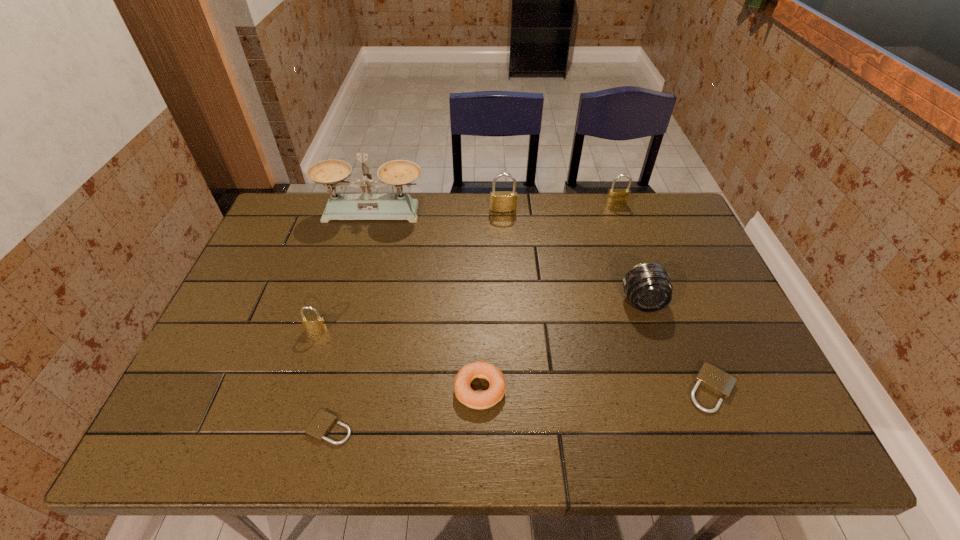
Image resolution: width=960 pixels, height=540 pixels. I want to click on free spot between the second farthest padlock and the tan bagel, so click(492, 300).

This screenshot has height=540, width=960. What are the coordinates of `vacant area between the biggest brass padlock and the third shortest object` in the screenshot? It's located at (492, 300).

Choose which object is the nearest neighbor to the bagel. Please provide its 2D coordinates. Your answer should be formatted as a tuple, i.e. [(x, y)], where the tuple contains the x and y coordinates of a point satisfying the conditions above.

[(322, 423)]

Select which object appears as the fourth closest to the fifth nearest object. Please provide its 2D coordinates. Your answer should be formatted as a tuple, i.e. [(x, y)], where the tuple contains the x and y coordinates of a point satisfying the conditions above.

[(501, 202)]

Locate an element on the screen. padlock that is the closest to the leftmost padlock is located at coordinates (322, 423).

Find the location of `padlock that is the closest to the second farthest padlock`. padlock that is the closest to the second farthest padlock is located at coordinates (617, 197).

Select which brass padlock is the third closest to the scale. Please provide its 2D coordinates. Your answer should be formatted as a tuple, i.e. [(x, y)], where the tuple contains the x and y coordinates of a point satisfying the conditions above.

[(617, 197)]

I want to click on brass padlock that stands as the closest to the scale, so click(x=501, y=202).

In order to click on free space that satisfies the following two spatial constraints: 1. on the front-facing side of the scale; 2. on the left side of the right beige padlock in this screenshot , I will do `click(324, 389)`.

Identify the location of free point that satisfies the following two spatial constraints: 1. on the front-facing side of the scale; 2. on the left side of the bigger beige padlock. (324, 389).